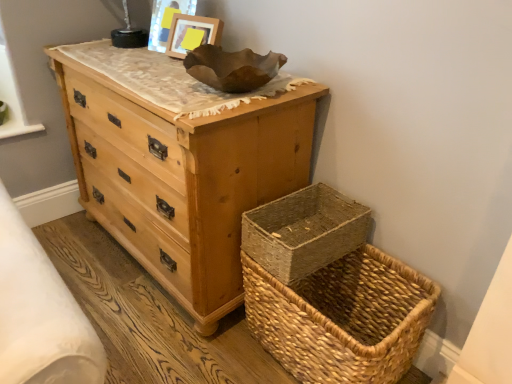
Where is `vacant area that lies between natural wood chest of drawers at upper left and natural woven picnic basket at lower right`? vacant area that lies between natural wood chest of drawers at upper left and natural woven picnic basket at lower right is located at coordinates (243, 359).